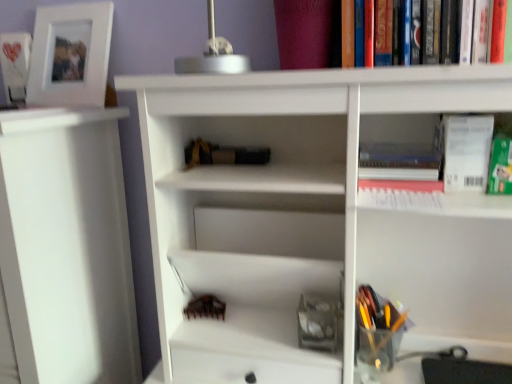
Question: From a real-world perspective, is black matte book at center, which is the second book from top to bottom, on top of white matte shelf at left?

Choices:
 (A) no
 (B) yes

Answer: (B)

Question: Does black matte book at center, the second book when ordered from right to left, touch white matte shelf at left?

Choices:
 (A) no
 (B) yes

Answer: (A)

Question: Is black matte book at center, the second book viewed from the left, at the left side of white matte shelf at left?

Choices:
 (A) no
 (B) yes

Answer: (A)

Question: Could you tell me if black matte book at center, the second book viewed from the left, is facing white matte shelf at left?

Choices:
 (A) no
 (B) yes

Answer: (A)

Question: Is the depth of black matte book at center, the second book from the bottom, greater than that of white matte shelf at left?

Choices:
 (A) no
 (B) yes

Answer: (B)

Question: Does black matte book at center, which is the second book from top to bottom, have a greater height compared to white matte shelf at left?

Choices:
 (A) yes
 (B) no

Answer: (B)

Question: Is white paper at upper right facing towards black matte book at center, the 2th book positioned from the front?

Choices:
 (A) yes
 (B) no

Answer: (B)

Question: Is white paper at upper right next to black matte book at center, the second book when ordered from right to left?

Choices:
 (A) no
 (B) yes

Answer: (A)

Question: Would you say white paper at upper right is outside black matte book at center, which is the second book from top to bottom?

Choices:
 (A) no
 (B) yes

Answer: (B)

Question: Are white paper at upper right and black matte book at center, the second book viewed from the left, far apart?

Choices:
 (A) no
 (B) yes

Answer: (A)

Question: Considering the relative sizes of white paper at upper right and black matte book at center, the second book when ordered from right to left, in the image provided, is white paper at upper right bigger than black matte book at center, the second book when ordered from right to left,?

Choices:
 (A) yes
 (B) no

Answer: (A)

Question: Is white paper at upper right at the left side of black matte book at center, the second book from the bottom?

Choices:
 (A) no
 (B) yes

Answer: (A)

Question: Is hardcover book at upper right, which is the third book from left to right, smaller than translucent plastic pen holder at lower right?

Choices:
 (A) no
 (B) yes

Answer: (B)